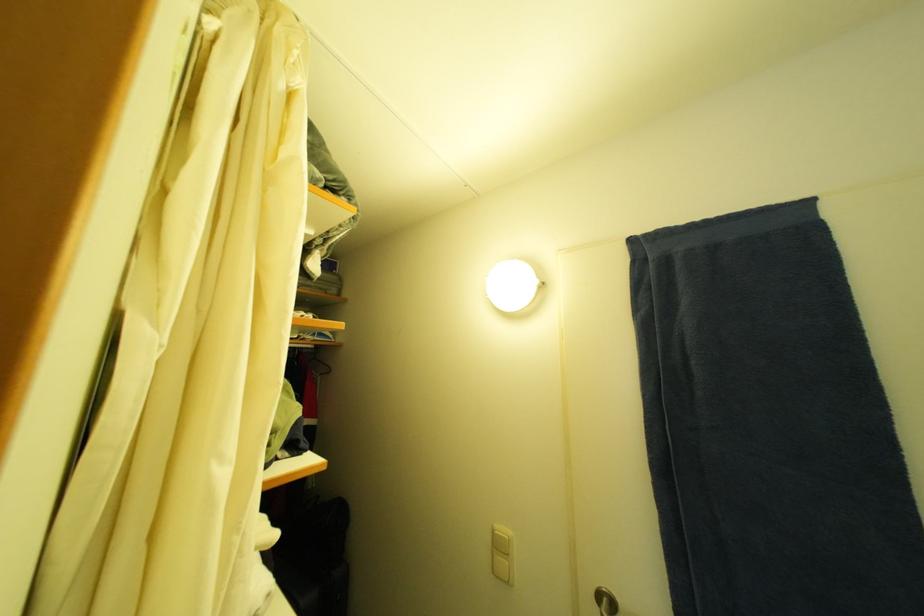
Find the location of `dark blue towel`. dark blue towel is located at coordinates (769, 424).